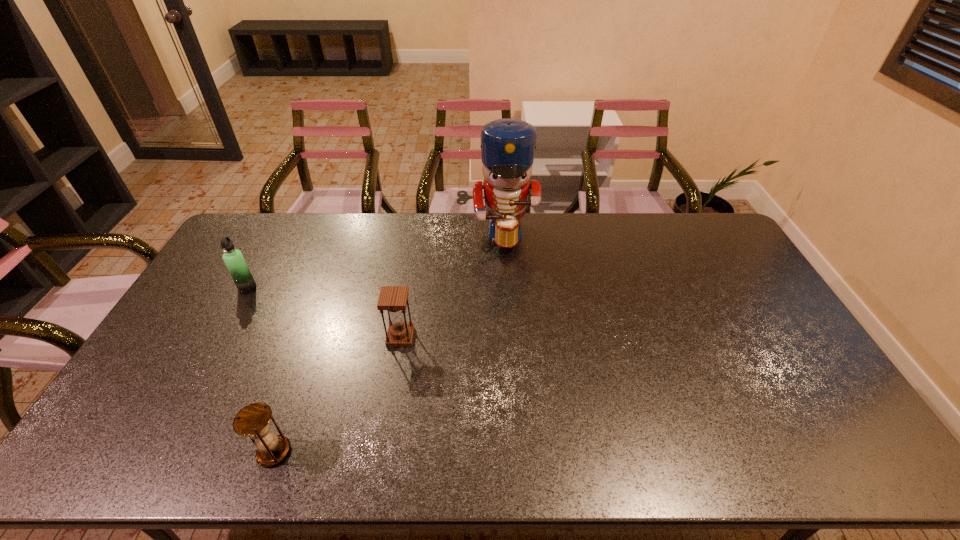
At what (x,y) coordinates should I click in order to perform the action: click on unoccupied position between the left hourglass and the leftmost object. Please return your answer as a coordinate pair (x, y). Looking at the image, I should click on (261, 369).

At what (x,y) coordinates should I click in order to perform the action: click on free point between the nearer hourglass and the third object from left to right. Please return your answer as a coordinate pair (x, y). Looking at the image, I should click on (337, 395).

In order to click on empty location between the third farthest object and the rightmost object in this screenshot , I will do `click(449, 286)`.

Find the location of a particular element. Image resolution: width=960 pixels, height=540 pixels. unoccupied area between the thermos bottle and the tallest object is located at coordinates (372, 261).

I want to click on vacant space that is in between the nearest object and the second tallest object, so click(261, 369).

The image size is (960, 540). I want to click on vacant area that lies between the leftmost object and the farther hourglass, so click(324, 312).

Locate an element on the screen. This screenshot has width=960, height=540. vacant space that is in between the nearest object and the leftmost object is located at coordinates (261, 369).

Identify the location of unoccupied position between the thermos bottle and the left hourglass. The height and width of the screenshot is (540, 960). (261, 369).

I want to click on free space that is in between the farthest object and the second farthest object, so click(372, 261).

This screenshot has height=540, width=960. I want to click on free space between the rightmost object and the thermos bottle, so click(372, 261).